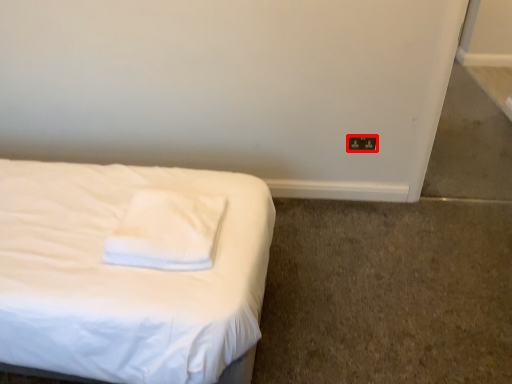
Question: From the image's perspective, what is the correct spatial relationship of electric outlet (annotated by the red box) in relation to pillow?

Choices:
 (A) below
 (B) above

Answer: (B)